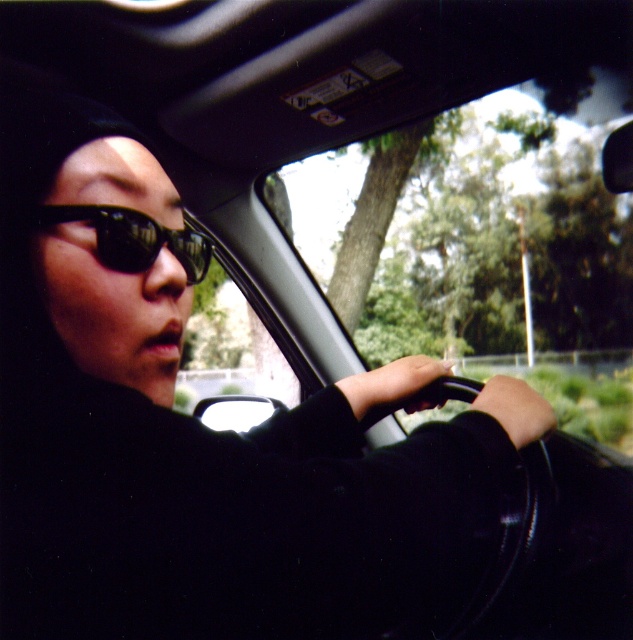
Based on the photo, you are a passenger in the car and want to see the view outside through the transparent glass car window at center without blocking your view of the driver wearing black reflective sunglasses at center. Is this possible?

The transparent glass car window at center is located above the black reflective sunglasses at center, so you can look up through the transparent glass car window at center while still seeing the driver wearing black reflective sunglasses at center below.

You are a passenger in a car and want to look at the view outside through the transparent glass car window at center while also checking the driver wearing black reflective sunglasses at center. Can you see both the outside view and the driver clearly at the same time?

The transparent glass car window at center is positioned on the right side of black reflective sunglasses at center, so you can see the outside view through the transparent glass car window at center while also seeing the driver wearing black reflective sunglasses at center clearly.